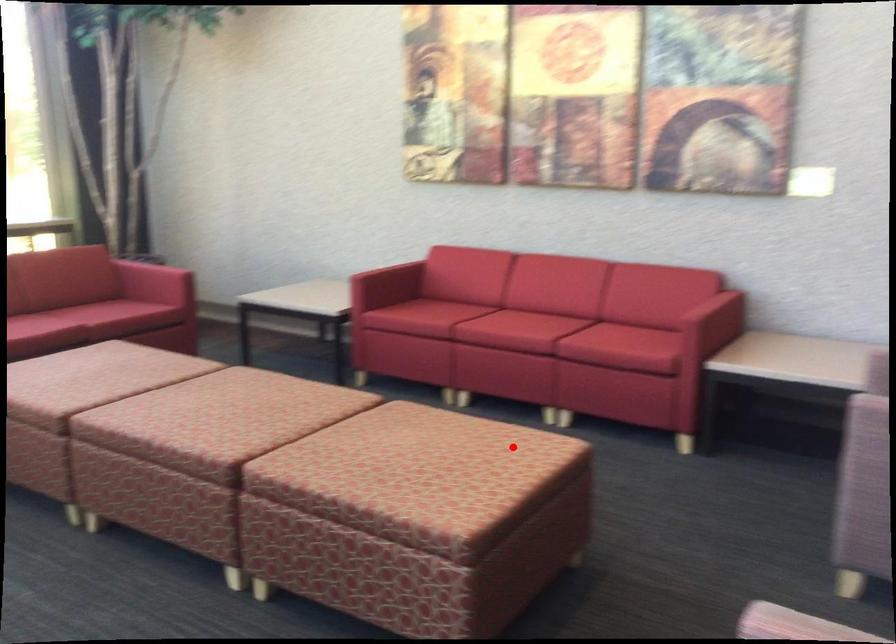
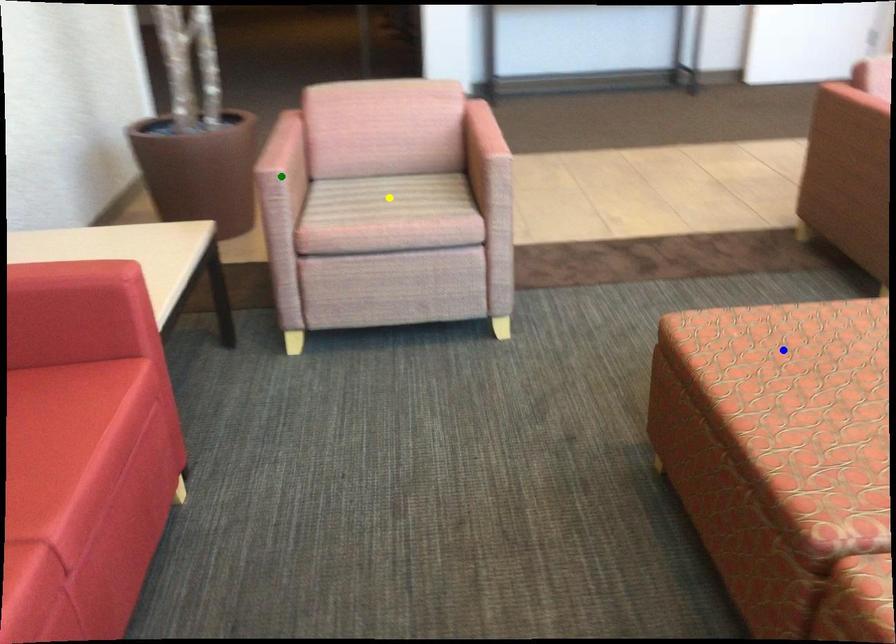
Question: I am providing you with two images of the same scene from different viewpoints. A red point is marked on the first image. You are given multiple points on the second image. Can you choose the point in image 2 that corresponds to the point in image 1?

Choices:
 (A) green point
 (B) yellow point
 (C) blue point

Answer: (C)